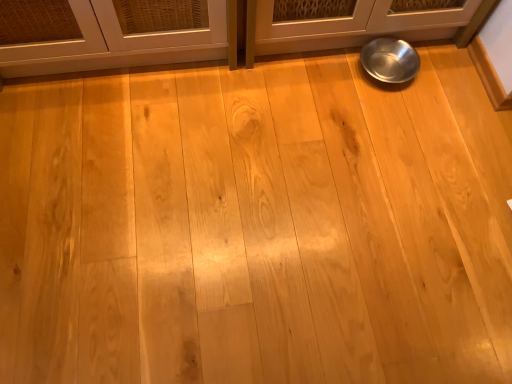
The image size is (512, 384). Describe the element at coordinates (390, 60) in the screenshot. I see `metallic silver bowl at lower right` at that location.

Identify the location of metallic silver bowl at lower right. The height and width of the screenshot is (384, 512). (390, 60).

You are a GUI agent. You are given a task and a screenshot of the screen. Output one action in this format:
    pyautogui.click(x=<x>, y=<y>)
    Task: Click on the metallic silver bowl at lower right
    
    Given the screenshot: What is the action you would take?
    pyautogui.click(x=390, y=60)